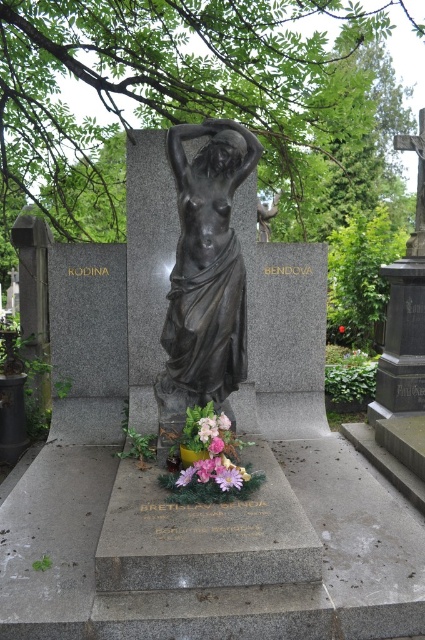
You are a gardener who needs to water the flowers in the cemetery. You have a watering can that can reach up to 5 meters. There are two flowers in front of the tombstone labeled as purple matte flower at center and pink matte flower at center. Can you water both flowers without moving the watering can?

The purple matte flower at center and pink matte flower at center are 5.55 meters apart from each other. Since the watering can can only reach up to 5 meters, you cannot water both flowers without moving the watering can because the distance between them exceeds the reach of the watering can.

You are standing in front of the tombstone and want to place a small bouquet between the two points marked as point (218, 172) and point (339, 328). Which point should you place the bouquet closer to so that it appears larger in the photo?

You should place the bouquet closer to point (218, 172) because it is closer to the camera than point (339, 328). Objects closer to the camera appear larger in the photo.